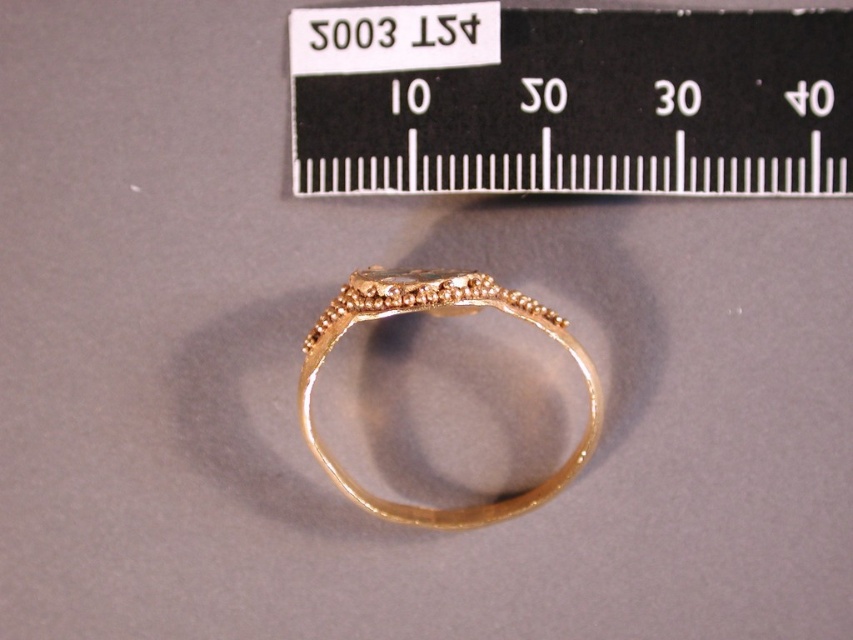
Question: Can you confirm if black plastic ruler at upper center is positioned above gold textured ring at center?

Choices:
 (A) yes
 (B) no

Answer: (A)

Question: Among these points, which one is nearest to the camera?

Choices:
 (A) (338, 113)
 (B) (355, 276)

Answer: (B)

Question: Considering the relative positions of black plastic ruler at upper center and gold textured ring at center in the image provided, where is black plastic ruler at upper center located with respect to gold textured ring at center?

Choices:
 (A) right
 (B) left

Answer: (A)

Question: Which of the following is the farthest from the observer?

Choices:
 (A) (361, 84)
 (B) (407, 516)

Answer: (A)

Question: Does black plastic ruler at upper center appear on the right side of gold textured ring at center?

Choices:
 (A) no
 (B) yes

Answer: (B)